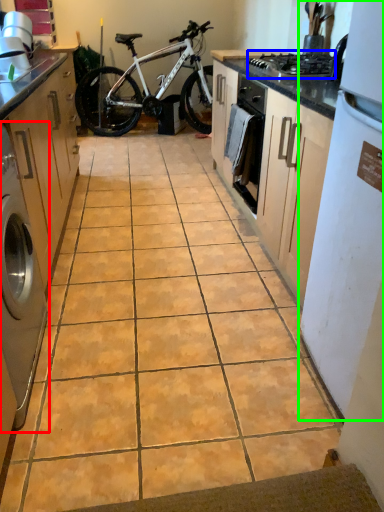
Question: Estimate the real-world distances between objects in this image. Which object is closer to home appliance (highlighted by a red box), gas stove (highlighted by a blue box) or kitchen appliance (highlighted by a green box)?

Choices:
 (A) gas stove
 (B) kitchen appliance

Answer: (B)